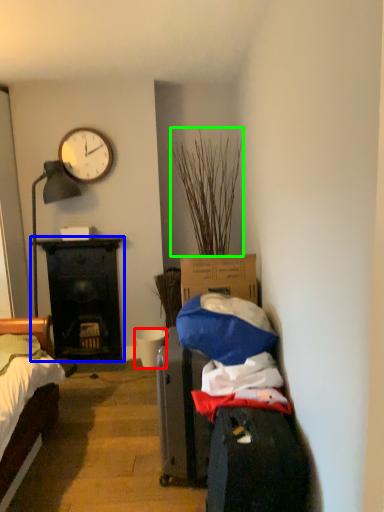
Question: Considering the real-world distances, which object is closest to bucket (highlighted by a red box)? desk (highlighted by a blue box) or plant (highlighted by a green box).

Choices:
 (A) desk
 (B) plant

Answer: (A)